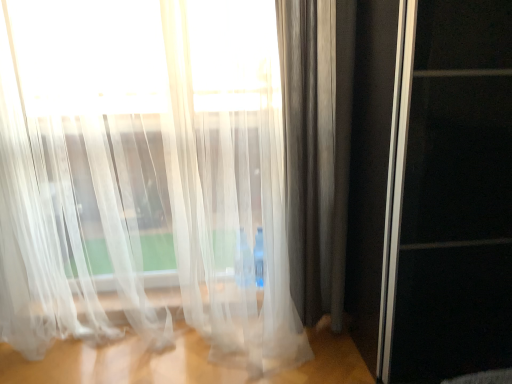
Measure the distance between transparent glass screen door at right and camera.

transparent glass screen door at right is 1.27 meters from camera.

The height and width of the screenshot is (384, 512). What do you see at coordinates (455, 197) in the screenshot? I see `transparent glass screen door at right` at bounding box center [455, 197].

Find the location of a particular element. This screenshot has width=512, height=384. transparent glass screen door at right is located at coordinates (455, 197).

Which of these two, transparent glass screen door at right or translucent white curtain at left, which is the 2th curtain from right to left, stands taller?

translucent white curtain at left, which is the 2th curtain from right to left.

Could you tell me if transparent glass screen door at right is turned towards translucent white curtain at left, which is the 2th curtain from right to left?

No, transparent glass screen door at right is not oriented towards translucent white curtain at left, which is the 2th curtain from right to left.

From a real-world perspective, which is physically above, transparent glass screen door at right or translucent white curtain at left, which is the 2th curtain from right to left?

translucent white curtain at left, which is the 2th curtain from right to left, from a real-world perspective.

Looking at this image, between satin gray curtain at right, placed as the second curtain when sorted from left to right, and translucent white curtain at left, positioned as the first curtain in left-to-right order, which one is positioned in front?

translucent white curtain at left, positioned as the first curtain in left-to-right order, is in front.

Who is shorter, satin gray curtain at right, placed as the 1th curtain when sorted from right to left, or translucent white curtain at left, which is the 2th curtain from right to left?

Standing shorter between the two is translucent white curtain at left, which is the 2th curtain from right to left.

Is satin gray curtain at right, placed as the 1th curtain when sorted from right to left, directly adjacent to translucent white curtain at left, positioned as the first curtain in left-to-right order?

satin gray curtain at right, placed as the 1th curtain when sorted from right to left, and translucent white curtain at left, positioned as the first curtain in left-to-right order, are clearly separated.

Considering the relative sizes of satin gray curtain at right, placed as the second curtain when sorted from left to right, and translucent white curtain at left, which is the 2th curtain from right to left, in the image provided, is satin gray curtain at right, placed as the second curtain when sorted from left to right, smaller than translucent white curtain at left, which is the 2th curtain from right to left,?

Yes, satin gray curtain at right, placed as the second curtain when sorted from left to right, is smaller than translucent white curtain at left, which is the 2th curtain from right to left.

Which point is more distant from viewer, (260, 207) or (352, 54)?

Positioned behind is point (260, 207).

Is translucent white curtain at left, positioned as the first curtain in left-to-right order, placed right next to satin gray curtain at right, placed as the second curtain when sorted from left to right?

No, translucent white curtain at left, positioned as the first curtain in left-to-right order, is not beside satin gray curtain at right, placed as the second curtain when sorted from left to right.

From their relative heights in the image, would you say translucent white curtain at left, which is the 2th curtain from right to left, is taller or shorter than satin gray curtain at right, placed as the 1th curtain when sorted from right to left?

Considering their sizes, translucent white curtain at left, which is the 2th curtain from right to left, has less height than satin gray curtain at right, placed as the 1th curtain when sorted from right to left.

Looking at this image, is translucent white curtain at left, positioned as the first curtain in left-to-right order, bigger or smaller than satin gray curtain at right, placed as the second curtain when sorted from left to right?

translucent white curtain at left, positioned as the first curtain in left-to-right order, is bigger than satin gray curtain at right, placed as the second curtain when sorted from left to right.

Considering the relative positions of satin gray curtain at right, placed as the 1th curtain when sorted from right to left, and transparent glass screen door at right in the image provided, is satin gray curtain at right, placed as the 1th curtain when sorted from right to left, to the left of transparent glass screen door at right from the viewer's perspective?

Yes, satin gray curtain at right, placed as the 1th curtain when sorted from right to left, is to the left of transparent glass screen door at right.

Considering the relative sizes of satin gray curtain at right, placed as the 1th curtain when sorted from right to left, and transparent glass screen door at right in the image provided, is satin gray curtain at right, placed as the 1th curtain when sorted from right to left, thinner than transparent glass screen door at right?

Yes.

Is satin gray curtain at right, placed as the second curtain when sorted from left to right, looking in the opposite direction of transparent glass screen door at right?

That's not correct — satin gray curtain at right, placed as the second curtain when sorted from left to right, is not looking away from transparent glass screen door at right.

From a real-world perspective, is satin gray curtain at right, placed as the 1th curtain when sorted from right to left, located higher than transparent glass screen door at right?

Correct, in the physical world, satin gray curtain at right, placed as the 1th curtain when sorted from right to left, is higher than transparent glass screen door at right.

Is translucent white curtain at left, positioned as the first curtain in left-to-right order, positioned beyond the bounds of transparent glass screen door at right?

translucent white curtain at left, positioned as the first curtain in left-to-right order, lies outside transparent glass screen door at right's area.

Does translucent white curtain at left, which is the 2th curtain from right to left, appear on the right side of transparent glass screen door at right?

Incorrect, translucent white curtain at left, which is the 2th curtain from right to left, is not on the right side of transparent glass screen door at right.

Is point (115, 172) positioned after point (507, 7)?

That is True.

Does translucent white curtain at left, positioned as the first curtain in left-to-right order, have a lesser height compared to transparent glass screen door at right?

No, translucent white curtain at left, positioned as the first curtain in left-to-right order, is not shorter than transparent glass screen door at right.

In terms of size, does transparent glass screen door at right appear bigger or smaller than satin gray curtain at right, placed as the 1th curtain when sorted from right to left?

Clearly, transparent glass screen door at right is larger in size than satin gray curtain at right, placed as the 1th curtain when sorted from right to left.

From a real-world perspective, which is physically below, transparent glass screen door at right or satin gray curtain at right, placed as the second curtain when sorted from left to right?

transparent glass screen door at right.

Is transparent glass screen door at right situated inside satin gray curtain at right, placed as the second curtain when sorted from left to right, or outside?

transparent glass screen door at right exists outside the volume of satin gray curtain at right, placed as the second curtain when sorted from left to right.

From the image's perspective, is transparent glass screen door at right positioned above or below satin gray curtain at right, placed as the 1th curtain when sorted from right to left?

Clearly, from the image's perspective, transparent glass screen door at right is below satin gray curtain at right, placed as the 1th curtain when sorted from right to left.

Where is `screen door located in front of the translucent white curtain at left, which is the 2th curtain from right to left`? screen door located in front of the translucent white curtain at left, which is the 2th curtain from right to left is located at coordinates (455, 197).

The height and width of the screenshot is (384, 512). Find the location of `curtain lying behind the translucent white curtain at left, which is the 2th curtain from right to left`. curtain lying behind the translucent white curtain at left, which is the 2th curtain from right to left is located at coordinates (316, 148).

Looking at this image, estimate the real-world distances between objects in this image. Which object is closer to transparent glass screen door at right, satin gray curtain at right, placed as the second curtain when sorted from left to right, or translucent white curtain at left, which is the 2th curtain from right to left?

satin gray curtain at right, placed as the second curtain when sorted from left to right, is positioned closer to the anchor transparent glass screen door at right.

Consider the image. Considering their positions, is translucent white curtain at left, which is the 2th curtain from right to left, positioned closer to satin gray curtain at right, placed as the 1th curtain when sorted from right to left, than transparent glass screen door at right?

translucent white curtain at left, which is the 2th curtain from right to left, lies closer to satin gray curtain at right, placed as the 1th curtain when sorted from right to left, than the other object.

From the image, which object appears to be nearer to transparent glass screen door at right, translucent white curtain at left, which is the 2th curtain from right to left, or satin gray curtain at right, placed as the 1th curtain when sorted from right to left?

satin gray curtain at right, placed as the 1th curtain when sorted from right to left.

Looking at the image, which one is located further to translucent white curtain at left, positioned as the first curtain in left-to-right order, transparent glass screen door at right or satin gray curtain at right, placed as the second curtain when sorted from left to right?

transparent glass screen door at right.

From the image, which object appears to be farther from satin gray curtain at right, placed as the second curtain when sorted from left to right, transparent glass screen door at right or translucent white curtain at left, positioned as the first curtain in left-to-right order?

transparent glass screen door at right lies further to satin gray curtain at right, placed as the second curtain when sorted from left to right, than the other object.

Looking at the image, which one is located further to translucent white curtain at left, positioned as the first curtain in left-to-right order, satin gray curtain at right, placed as the 1th curtain when sorted from right to left, or transparent glass screen door at right?

Based on the image, transparent glass screen door at right appears to be further to translucent white curtain at left, positioned as the first curtain in left-to-right order.

The image size is (512, 384). I want to click on curtain between translucent white curtain at left, which is the 2th curtain from right to left, and transparent glass screen door at right from left to right, so click(x=316, y=148).